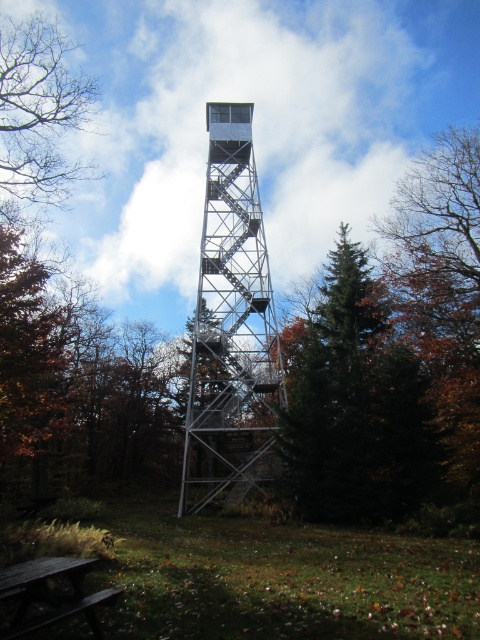
Question: Is bare branches at upper left bigger than dark brown wooden picnic table at lower left?

Choices:
 (A) no
 (B) yes

Answer: (B)

Question: Does bare branches at upper left appear over dark brown wooden picnic table at lower left?

Choices:
 (A) yes
 (B) no

Answer: (A)

Question: Which point appears farthest from the camera in this image?

Choices:
 (A) (8, 595)
 (B) (11, 145)
 (C) (259, 401)

Answer: (C)

Question: Which object is farther from the camera taking this photo?

Choices:
 (A) metallic silver tower at center
 (B) bare branches at upper left
 (C) dark brown wooden picnic table at lower left

Answer: (A)

Question: Is metallic silver tower at center further to camera compared to dark brown wooden picnic table at lower left?

Choices:
 (A) yes
 (B) no

Answer: (A)

Question: Which of the following is the closest to the observer?

Choices:
 (A) 263,392
 (B) 48,58
 (C) 8,588

Answer: (C)